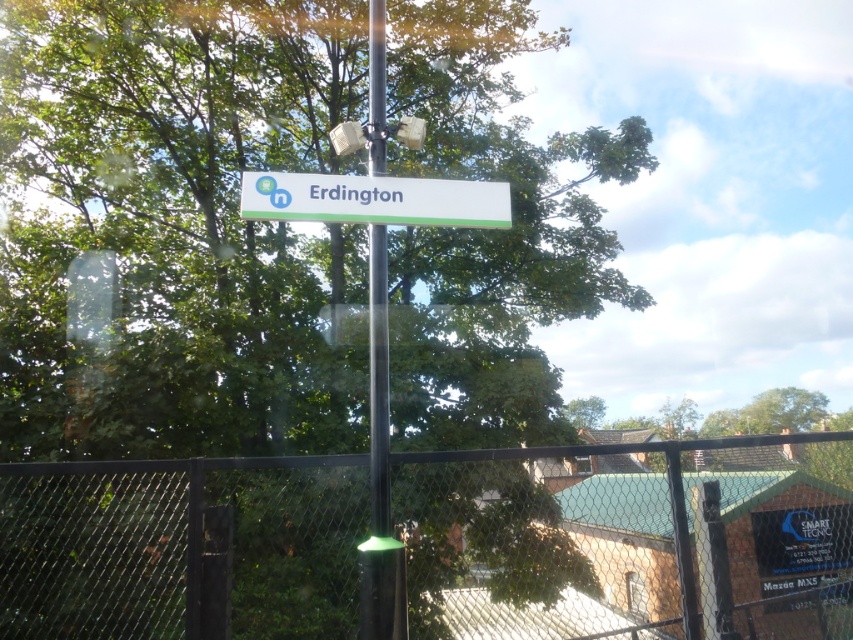
You are a delivery robot navigating a street. You see the black metallic pole at center and the white plastic sign at center. Which object is positioned lower in the image?

The black metallic pole at center is positioned lower than the white plastic sign at center according to the description.